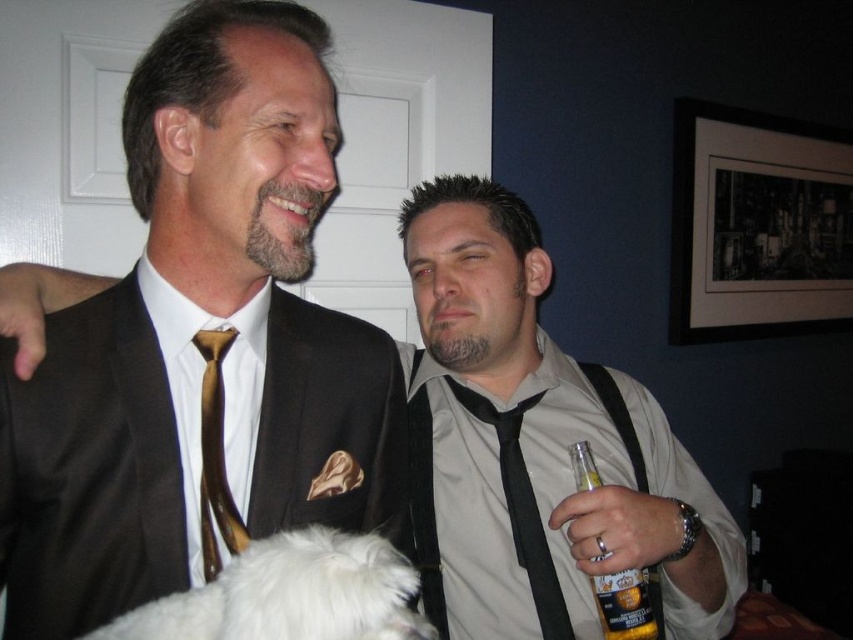
You are a photographer trying to capture a candid shot of the two people in the scene. You notice the matte black shirt at center and the white fluffy dog at lower left. Which object should you focus on first if you want to capture the subject who is higher in the frame?

The matte black shirt at center is above the white fluffy dog at lower left, so you should focus on the matte black shirt at center first to capture the subject higher in the frame.

Please describe the exact coordinates of the matte black shirt at center in the image.

The matte black shirt at center is located at coordinates point (537, 445).

You are designing a necklace that will hang between the matte black shirt at center and the black satin tie at center. The necklace needs to be 3.81 inches long to fit perfectly between them. Is the necklace the correct length?

Yes, the necklace will be the correct length because the distance between the matte black shirt at center and the black satin tie at center is exactly 3.81 inches.